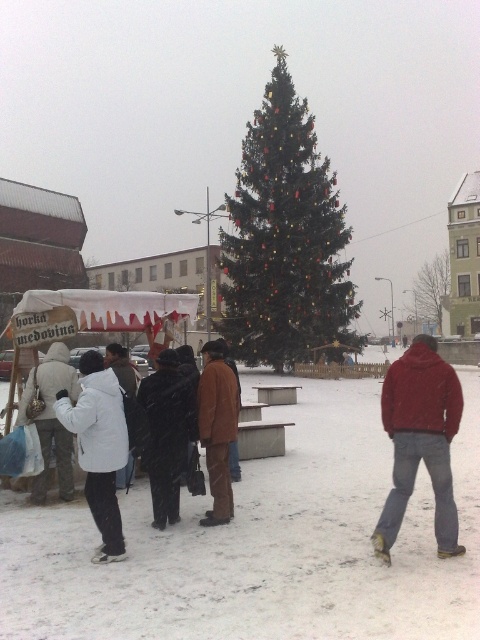
Can you confirm if black wool coat at center is positioned to the right of white woolen coat at left?

Correct, you'll find black wool coat at center to the right of white woolen coat at left.

Does black wool coat at center appear under white woolen coat at left?

No.

The height and width of the screenshot is (640, 480). Identify the location of black wool coat at center. (168, 433).

I want to click on black wool coat at center, so click(x=168, y=433).

Based on the photo, does brown leather jacket at center have a lesser height compared to white woolen coat at left?

Correct, brown leather jacket at center is not as tall as white woolen coat at left.

Is brown leather jacket at center thinner than white woolen coat at left?

Yes.

Is point (231, 508) positioned behind point (35, 493)?

No, it is not.

I want to click on brown leather jacket at center, so click(x=216, y=429).

Does point (110, 548) lie behind point (165, 483)?

No, it is in front of (165, 483).

Can you confirm if white matte jacket at left is bigger than black wool coat at center?

Incorrect, white matte jacket at left is not larger than black wool coat at center.

Between point (104, 561) and point (156, 410), which one is positioned in front?

Point (104, 561) is more forward.

Where is `white matte jacket at left`? Image resolution: width=480 pixels, height=640 pixels. white matte jacket at left is located at coordinates tap(98, 445).